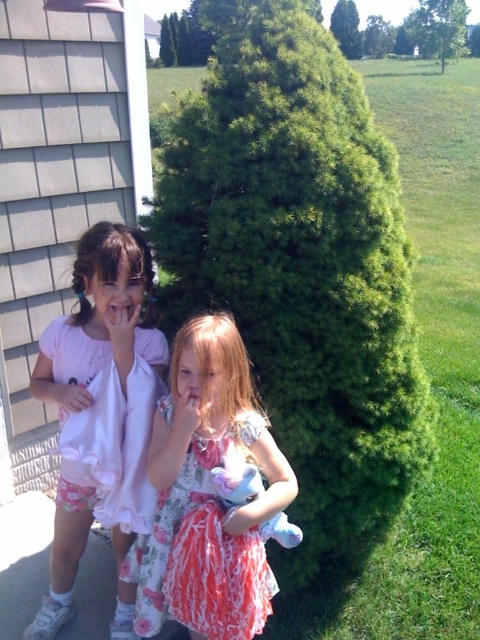
Question: Can you confirm if green leafy bush at center is bigger than pink satin dress at left?

Choices:
 (A) yes
 (B) no

Answer: (A)

Question: Is green leafy bush at center thinner than pink satin dress at left?

Choices:
 (A) no
 (B) yes

Answer: (A)

Question: Which object is closer to the camera taking this photo?

Choices:
 (A) pink satin dress at left
 (B) matte white shirt at left
 (C) floral dress at center
 (D) green leafy bush at center

Answer: (C)

Question: Which point is farther from the camera taking this photo?

Choices:
 (A) (191, 547)
 (B) (260, 58)
 (C) (72, 330)
 (D) (34, 621)

Answer: (D)

Question: Estimate the real-world distances between objects in this image. Which object is closer to the green leafy bush at center?

Choices:
 (A) pink satin dress at left
 (B) floral dress at center

Answer: (B)

Question: From the image, what is the correct spatial relationship of green leafy bush at center in relation to pink satin dress at left?

Choices:
 (A) right
 (B) left

Answer: (A)